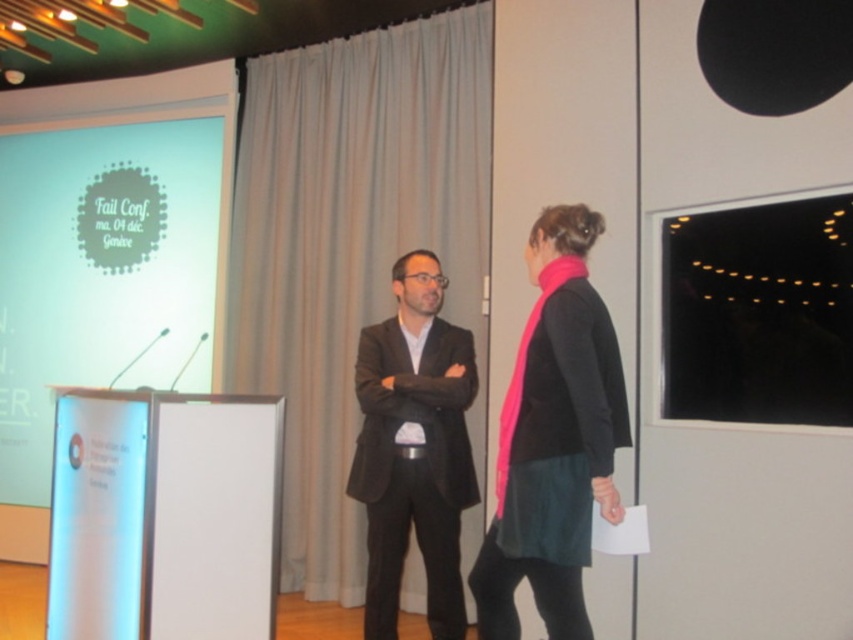
You are organizing a photo shoot and need to ensure proper lighting for the pink matte scarf at right and the matte black suit at center. Based on their positions, which object should be lit first to avoid shadows affecting both?

The pink matte scarf at right should be lit first since it is positioned above the matte black suit at center. Lighting the higher object first helps prevent shadows from the scarf from falling onto the lower suit.

You are an event planner standing at the entrance of the conference room. You need to locate the pink matte scarf at right for a photo shoot. Based on the coordinates provided, where should you position yourself to capture the scarf in the center of your camera frame?

The pink matte scarf at right is located at coordinates point [553,438]. To center it in your camera frame, position yourself so the camera is aimed directly at those coordinates.

You are organizing a conference and need to ensure that the pink matte scarf at right and the black matte projection screen at upper right are visible to all attendees. Considering their sizes, which object might require additional lighting to ensure visibility?

The black matte projection screen at upper right might require additional lighting to ensure visibility because the pink matte scarf at right has a larger size compared to it, making the screen potentially less noticeable from a distance.